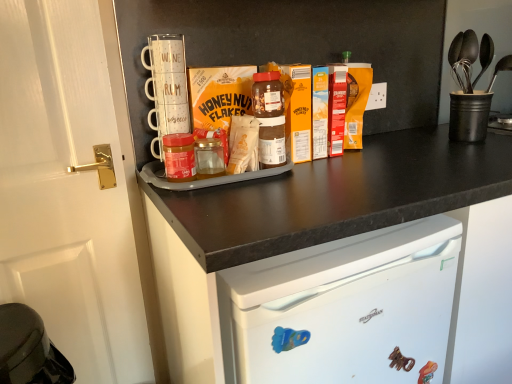
Question: Is matte cardboard honey nut flakes at center in front of or behind matte glass jar at center in the image?

Choices:
 (A) behind
 (B) front

Answer: (A)

Question: Based on their sizes in the image, would you say matte cardboard honey nut flakes at center is bigger or smaller than matte glass jar at center?

Choices:
 (A) small
 (B) big

Answer: (B)

Question: Estimate the real-world distances between objects in this image. Which object is closer to the black matte cup at upper right?

Choices:
 (A) white glossy door at left
 (B) matte cardboard honey nut flakes at center
 (C) matte glass jar at center
 (D) black matte cabinet at center

Answer: (D)

Question: Estimate the real-world distances between objects in this image. Which object is farther from the matte cardboard honey nut flakes at center?

Choices:
 (A) matte glass jar at center
 (B) black matte cabinet at center
 (C) black matte cup at upper right
 (D) white glossy door at left

Answer: (C)